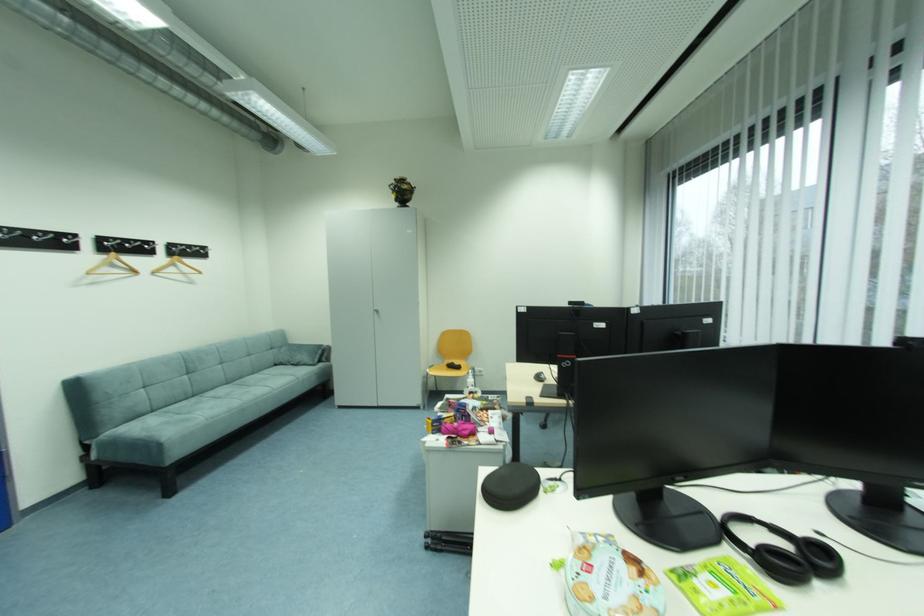
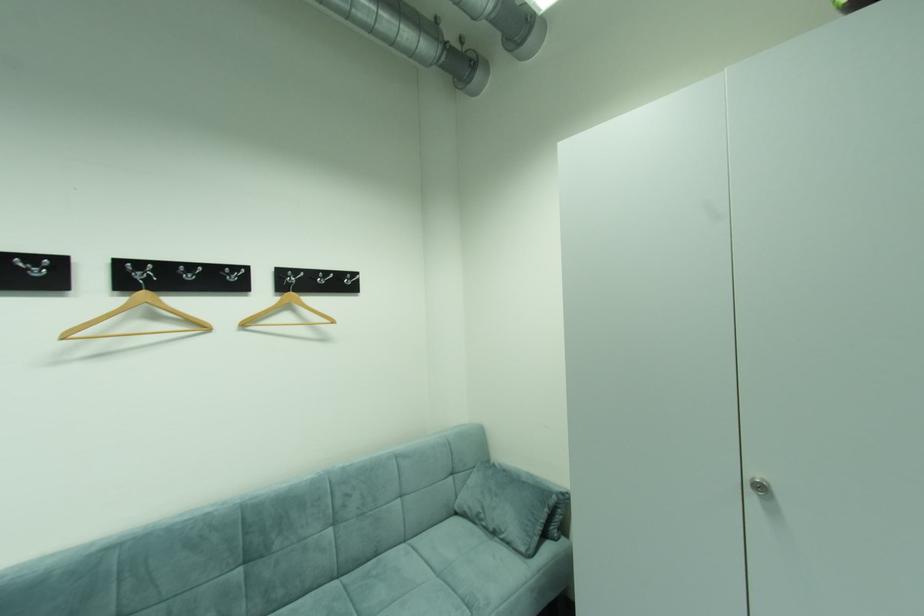
Find the pixel in the second image that matches point (177, 246) in the first image.

(286, 274)